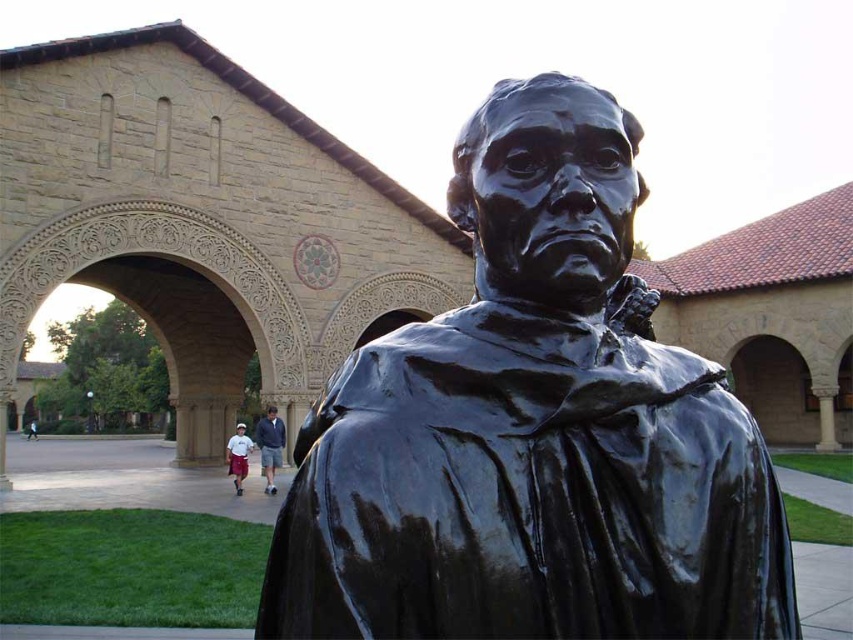
Question: Considering the relative positions of glossy bronze statue at center and white cotton shorts at lower left in the image provided, where is glossy bronze statue at center located with respect to white cotton shorts at lower left?

Choices:
 (A) right
 (B) left

Answer: (A)

Question: Estimate the real-world distances between objects in this image. Which object is closer to the white cotton shorts at lower left?

Choices:
 (A) glossy bronze statue at center
 (B) light blue denim shorts at lower center

Answer: (B)

Question: Which object is positioned farthest from the light blue denim shorts at lower center?

Choices:
 (A) glossy bronze statue at center
 (B) white cotton shorts at lower left

Answer: (A)

Question: Does glossy bronze statue at center lie in front of light blue denim shorts at lower center?

Choices:
 (A) no
 (B) yes

Answer: (B)

Question: Does light blue denim shorts at lower center appear over white cotton shorts at lower left?

Choices:
 (A) no
 (B) yes

Answer: (B)

Question: Which of the following is the closest to the observer?

Choices:
 (A) light blue denim shorts at lower center
 (B) white cotton shorts at lower left
 (C) glossy bronze statue at center

Answer: (C)